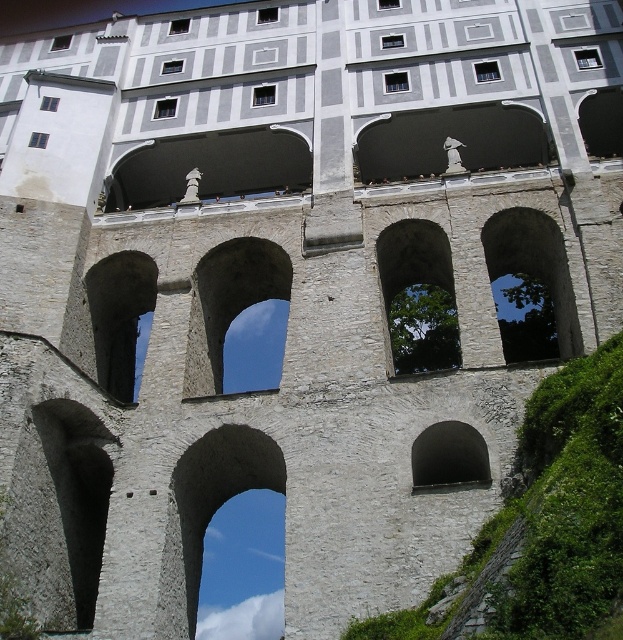
Question: Which of these objects is positioned farthest from the green mossy hillside at lower right?

Choices:
 (A) smooth stone archway at center
 (B) black stone archway at center
 (C) gray stone archway at center

Answer: (A)

Question: Is the position of green mossy hillside at lower right more distant than that of black stone archway at center?

Choices:
 (A) no
 (B) yes

Answer: (A)

Question: In this image, where is green mossy hillside at lower right located relative to smooth stone archway at center?

Choices:
 (A) right
 (B) left

Answer: (A)

Question: Estimate the real-world distances between objects in this image. Which object is farther from the gray stone archway at center?

Choices:
 (A) black stone archway at center
 (B) green mossy hillside at lower right

Answer: (A)

Question: Does green mossy hillside at lower right lie behind smooth stone archway at center?

Choices:
 (A) no
 (B) yes

Answer: (A)

Question: Which of these objects is positioned closest to the black stone archway at center?

Choices:
 (A) smooth stone archway at center
 (B) gray stone archway at center

Answer: (B)